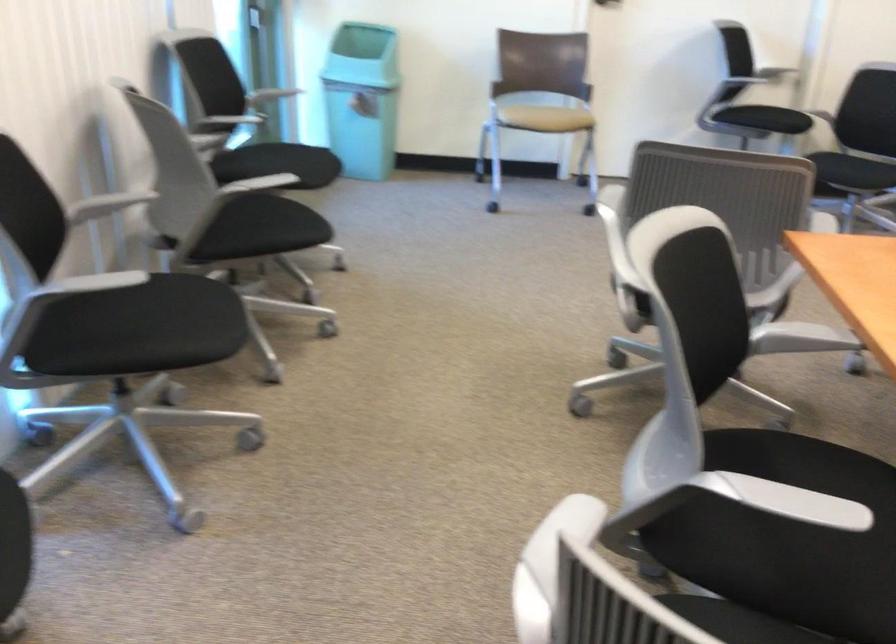
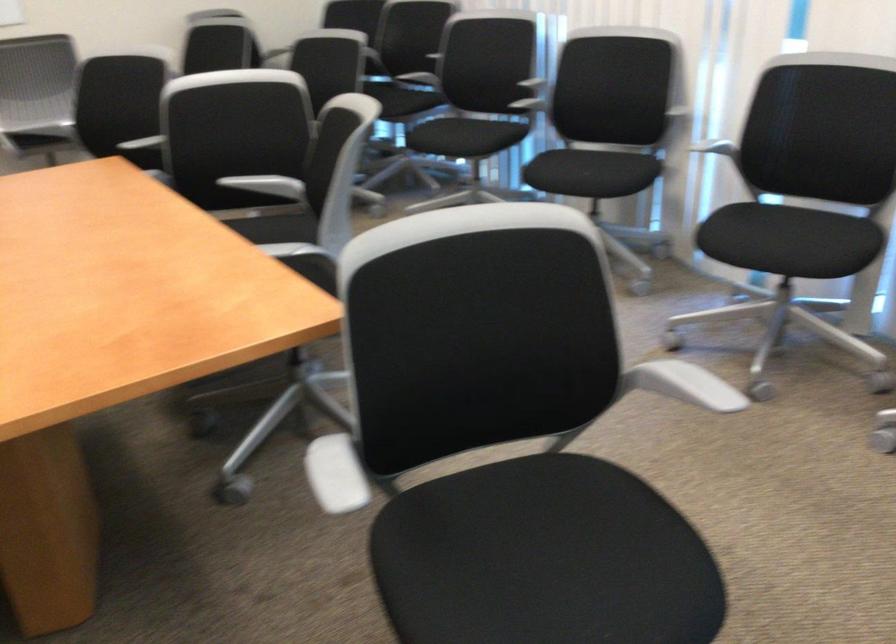
Where in the second image is the point corresponding to the point at 179,298 from the first image?

(789, 240)